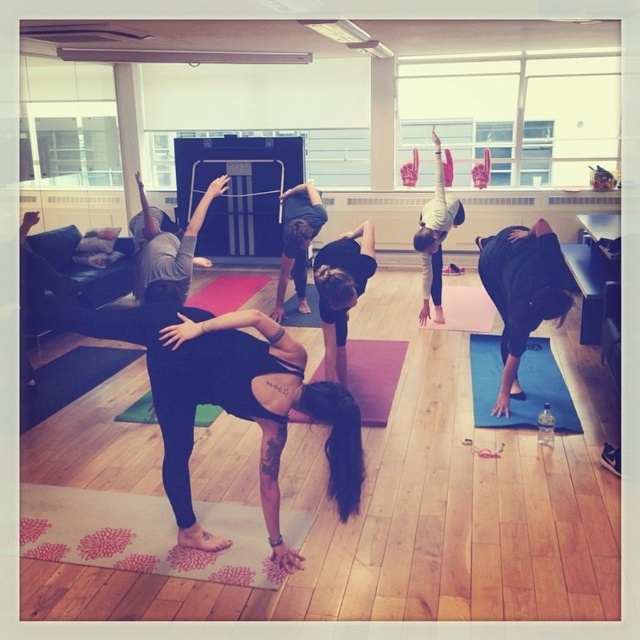
Question: Can you confirm if pink floral yoga mat at lower center is thinner than black matte yoga mat at lower right?

Choices:
 (A) no
 (B) yes

Answer: (A)

Question: Can you confirm if blue rubber yoga mat at lower right is bigger than black matte leggings at center?

Choices:
 (A) yes
 (B) no

Answer: (B)

Question: Among these objects, which one is nearest to the camera?

Choices:
 (A) white matte yoga mat at center
 (B) blue rubber yoga mat at lower right
 (C) pink rubber yoga mat at center
 (D) matte pink yoga mat at lower center

Answer: (B)

Question: Estimate the real-world distances between objects in this image. Which object is farther from the pink rubber yoga mat at center?

Choices:
 (A) pink floral yoga mat at lower center
 (B) matte pink yoga mat at lower center

Answer: (B)

Question: Does matte pink yoga mat at lower center have a greater width compared to white matte yoga mat at center?

Choices:
 (A) yes
 (B) no

Answer: (A)

Question: Estimate the real-world distances between objects in this image. Which object is farther from the matte pink yoga mat at lower center?

Choices:
 (A) black matte leggings at center
 (B) black matte yoga mat at lower right
 (C) white matte yoga mat at center
 (D) blue rubber yoga mat at lower right

Answer: (B)